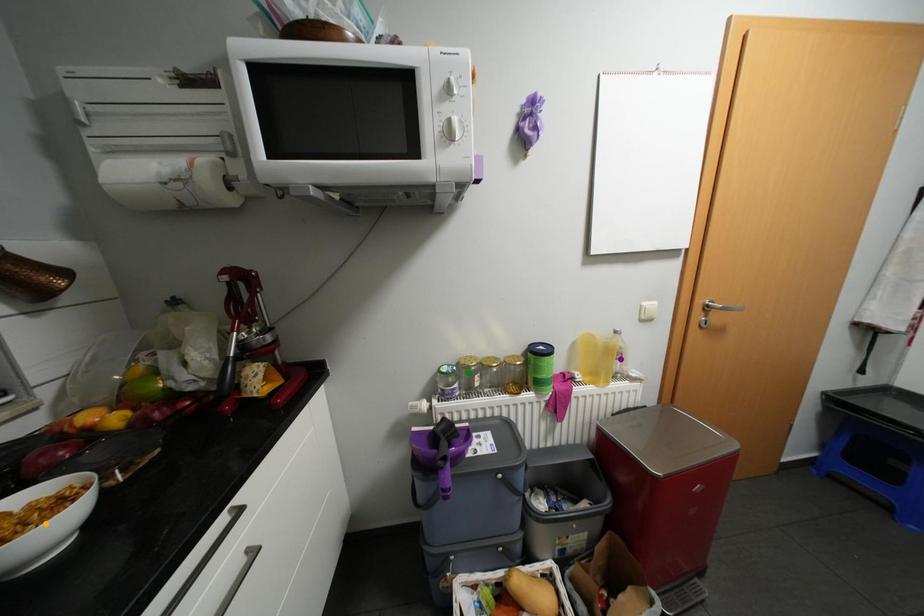
Order these from nearest to farthest:
purple point | green point | orange point

purple point, green point, orange point